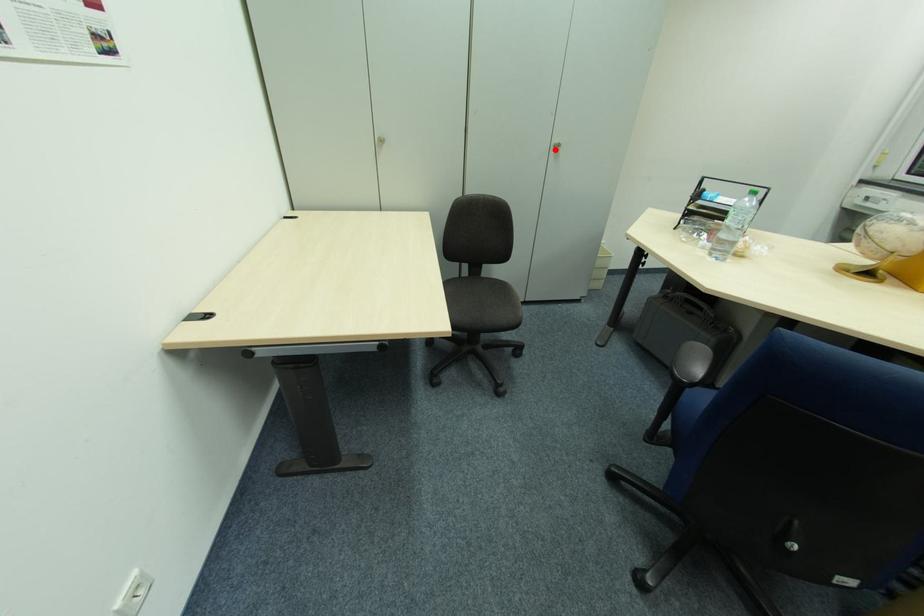
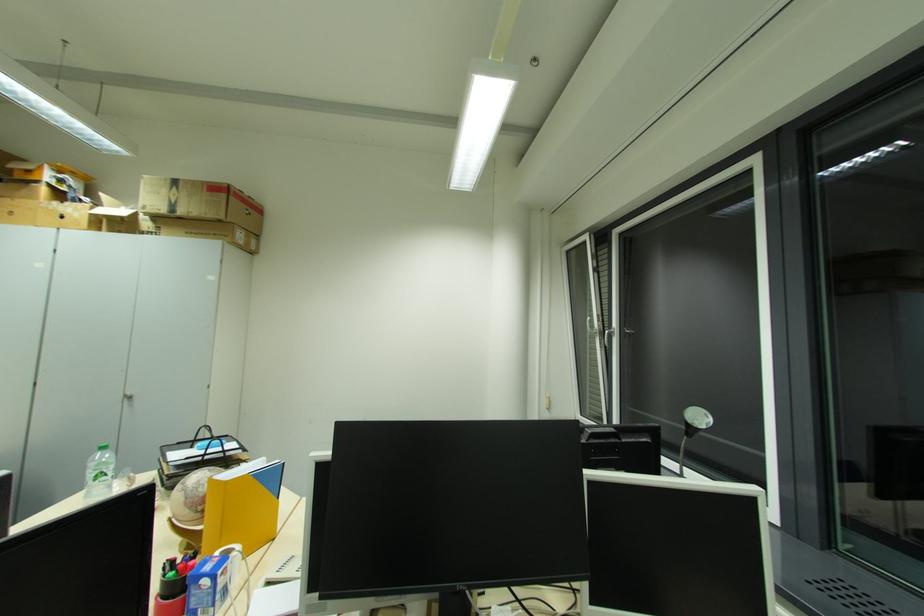
The point at the highlighted location is marked in the first image. Where is the corresponding point in the second image?

(128, 400)